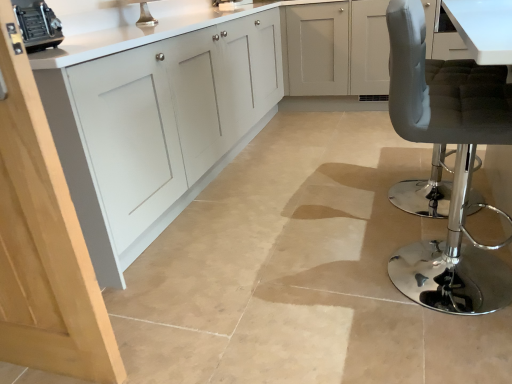
You are a GUI agent. You are given a task and a screenshot of the screen. Output one action in this format:
    pyautogui.click(x=<x>, y=<y>)
    Task: Click on the matte gray cushioned stool at right
    This screenshot has height=384, width=512.
    Given the screenshot: What is the action you would take?
    pyautogui.click(x=455, y=164)

Is matte gray cushioned stool at right surrounding matte white cabinets at center?

That's incorrect, matte white cabinets at center is not inside matte gray cushioned stool at right.

Is matte gray cushioned stool at right far from matte white cabinets at center?

Yes.

Between matte gray cushioned stool at right and matte white cabinets at center, which one has larger size?

matte white cabinets at center is bigger.

The height and width of the screenshot is (384, 512). In the image, there is a matte gray cushioned stool at right. In order to click on cabinetry above it (from the image's perspective) in this screenshot , I will do `click(180, 107)`.

Is matte white cabinets at center bigger than metallic silver toaster at upper left?

Yes.

Looking at their sizes, would you say matte white cabinets at center is wider or thinner than metallic silver toaster at upper left?

matte white cabinets at center is wider than metallic silver toaster at upper left.

Which object is closer to the camera taking this photo, metallic silver toaster at upper left or matte gray cushioned stool at right?

matte gray cushioned stool at right.

Is metallic silver toaster at upper left beside matte gray cushioned stool at right?

They are not placed beside each other.

Is matte gray cushioned stool at right at the back of metallic silver toaster at upper left?

metallic silver toaster at upper left is not turned away from matte gray cushioned stool at right.

Which of these two, metallic silver toaster at upper left or matte gray cushioned stool at right, is smaller?

With smaller size is metallic silver toaster at upper left.

Considering the positions of points (48, 22) and (86, 188), is point (48, 22) closer to camera compared to point (86, 188)?

No, (48, 22) is further to viewer.

From a real-world perspective, is metallic silver toaster at upper left under matte white cabinets at center?

No, from a real-world perspective, metallic silver toaster at upper left is not beneath matte white cabinets at center.

Does metallic silver toaster at upper left have a lesser width compared to matte white cabinets at center?

Yes.

From the image's perspective, would you say metallic silver toaster at upper left is shown under matte white cabinets at center?

Indeed, from the image's perspective, metallic silver toaster at upper left is shown beneath matte white cabinets at center.

Which is less distant, (401, 120) or (25, 25)?

The point (401, 120) is closer to the camera.

Locate an element on the screen. Image resolution: width=512 pixels, height=384 pixels. appliance above the matte gray cushioned stool at right (from a real-world perspective) is located at coordinates (37, 25).

Could metallic silver toaster at upper left be considered to be inside matte gray cushioned stool at right?

No.

From a real-world perspective, between matte white cabinets at center and matte gray cushioned stool at right, who is vertically higher?

From a 3D spatial view, matte white cabinets at center is above.

Between matte white cabinets at center and matte gray cushioned stool at right, which one has more height?

matte white cabinets at center is taller.

From the image's perspective, is matte white cabinets at center beneath matte gray cushioned stool at right?

Incorrect, from the image's perspective, matte white cabinets at center is higher than matte gray cushioned stool at right.

Is matte white cabinets at center bigger than matte gray cushioned stool at right?

Yes.

At what (x,y) coordinates should I click in order to perform the action: click on chair located underneath the matte white cabinets at center (from a real-world perspective). Please return your answer as a coordinate pair (x, y). Image resolution: width=512 pixels, height=384 pixels. Looking at the image, I should click on (455, 164).

The width and height of the screenshot is (512, 384). In order to click on appliance that appears behind the matte white cabinets at center in this screenshot , I will do `click(37, 25)`.

Based on their spatial positions, is metallic silver toaster at upper left or matte gray cushioned stool at right closer to matte white cabinets at center?

Among the two, metallic silver toaster at upper left is located nearer to matte white cabinets at center.

Based on their spatial positions, is metallic silver toaster at upper left or matte white cabinets at center further from matte gray cushioned stool at right?

metallic silver toaster at upper left is further to matte gray cushioned stool at right.

Based on their spatial positions, is matte white cabinets at center or matte gray cushioned stool at right further from metallic silver toaster at upper left?

matte gray cushioned stool at right.

From the image, which object appears to be nearer to metallic silver toaster at upper left, matte gray cushioned stool at right or matte white cabinets at center?

matte white cabinets at center lies closer to metallic silver toaster at upper left than the other object.

From the image, which object appears to be nearer to matte white cabinets at center, matte gray cushioned stool at right or metallic silver toaster at upper left?

The object closer to matte white cabinets at center is metallic silver toaster at upper left.

Based on the photo, considering their positions, is matte white cabinets at center positioned closer to matte gray cushioned stool at right than metallic silver toaster at upper left?

Among the two, matte white cabinets at center is located nearer to matte gray cushioned stool at right.

You are a GUI agent. You are given a task and a screenshot of the screen. Output one action in this format:
    pyautogui.click(x=<x>, y=<y>)
    Task: Click on the cabinetry between metallic silver toaster at upper left and matte gray cushioned stool at right from left to right
    The height and width of the screenshot is (384, 512).
    Given the screenshot: What is the action you would take?
    pyautogui.click(x=180, y=107)